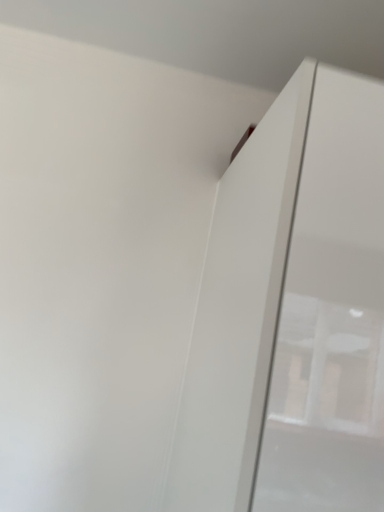
What do you see at coordinates (330, 314) in the screenshot? I see `transparent glossy glass door at upper right` at bounding box center [330, 314].

Where is `transparent glossy glass door at upper right`? transparent glossy glass door at upper right is located at coordinates (330, 314).

You are a GUI agent. You are given a task and a screenshot of the screen. Output one action in this format:
    pyautogui.click(x=<x>, y=<y>)
    Task: Click on the transparent glossy glass door at upper right
    This screenshot has width=384, height=512.
    Given the screenshot: What is the action you would take?
    pyautogui.click(x=330, y=314)